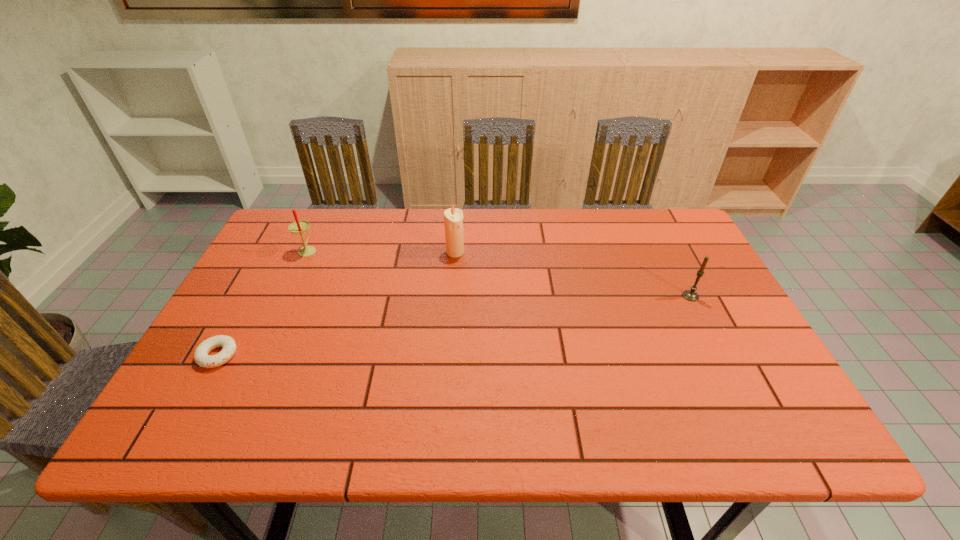
Identify the location of candle located at the left edge. The height and width of the screenshot is (540, 960). (300, 226).

Image resolution: width=960 pixels, height=540 pixels. Find the location of `doughnut that is at the left edge`. doughnut that is at the left edge is located at coordinates (201, 357).

The image size is (960, 540). I want to click on object that is positioned at the right edge, so click(x=691, y=295).

Where is `object that is at the far left corner`? object that is at the far left corner is located at coordinates (300, 226).

Identify the location of free location at the far edge. (515, 241).

Find the location of `vacant area at the near edge of the desktop`. vacant area at the near edge of the desktop is located at coordinates click(348, 436).

The width and height of the screenshot is (960, 540). In the image, there is a desktop. What are the coordinates of `vacant space at the left edge` in the screenshot? It's located at (282, 256).

This screenshot has height=540, width=960. In the image, there is a desktop. In order to click on blank space at the right edge in this screenshot , I will do `click(693, 326)`.

The height and width of the screenshot is (540, 960). What are the coordinates of `vacant area at the far left corner` in the screenshot? It's located at (326, 212).

Where is `free space between the third object from left to right and the rightmost candle`? The height and width of the screenshot is (540, 960). free space between the third object from left to right and the rightmost candle is located at coordinates (573, 274).